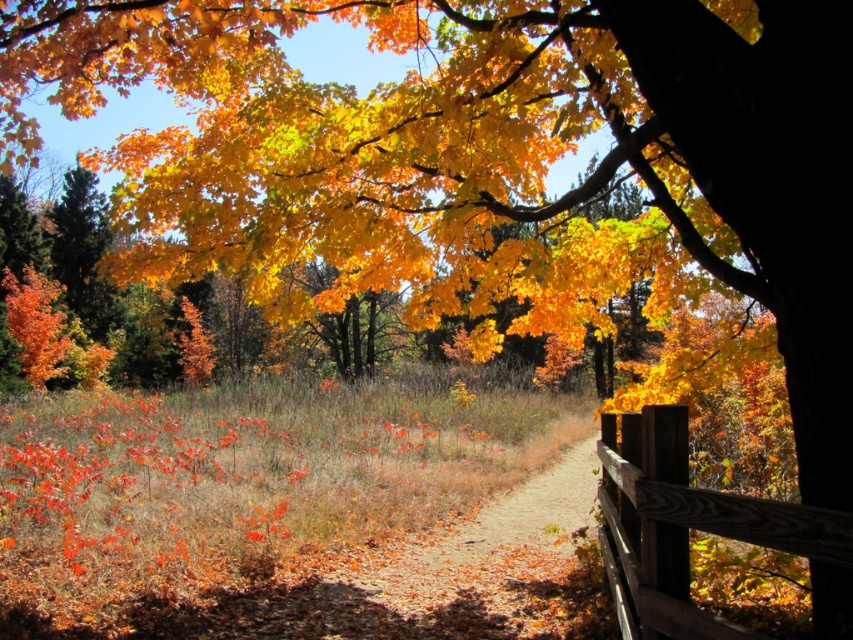
You are standing on the brown wooden fence at lower right and want to walk down to the brown dirt path at center. Is the path directly below the fence?

Yes, the brown dirt path at center is directly below the brown wooden fence at lower right, so you can walk down to it.

You are a hiker standing at the start of the dirt path. You want to walk along the path towards the fence. Which object will you encounter first, the brown dirt path at center or the brown wooden fence at lower right?

You will encounter the brown dirt path at center first because it is closer to you than the brown wooden fence at lower right, which is further away.